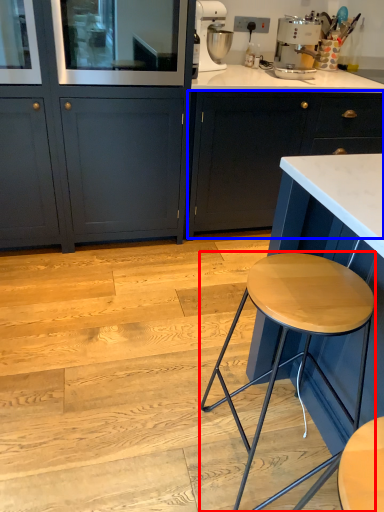
Question: Which object appears farthest to the camera in this image, stool (highlighted by a red box) or cabinetry (highlighted by a blue box)?

Choices:
 (A) stool
 (B) cabinetry

Answer: (B)